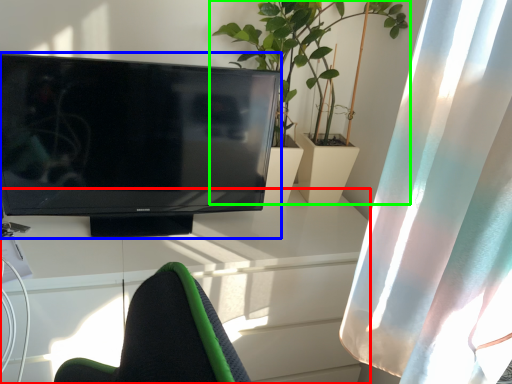
Question: Considering the real-world distances, which object is closest to desk (highlighted by a red box)? television (highlighted by a blue box) or houseplant (highlighted by a green box).

Choices:
 (A) television
 (B) houseplant

Answer: (A)